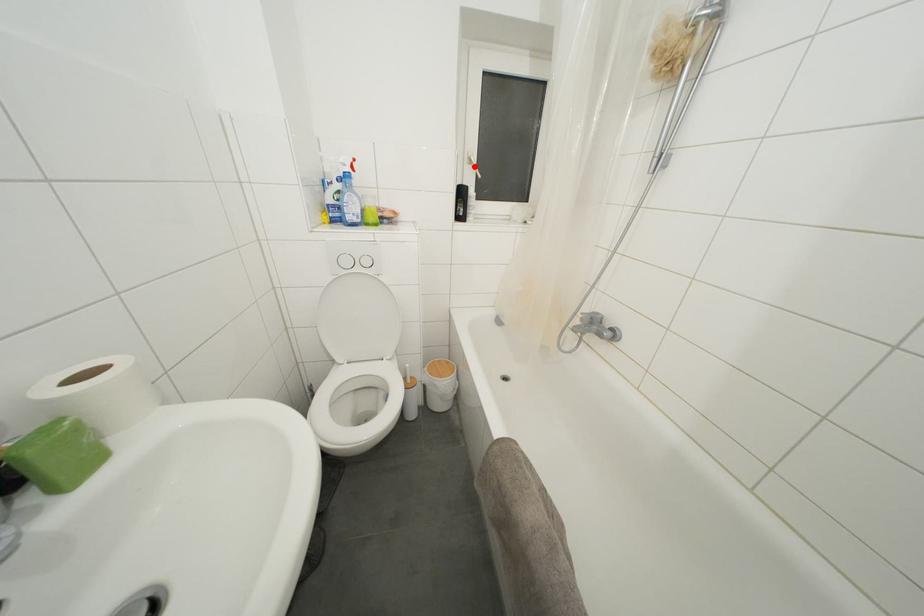
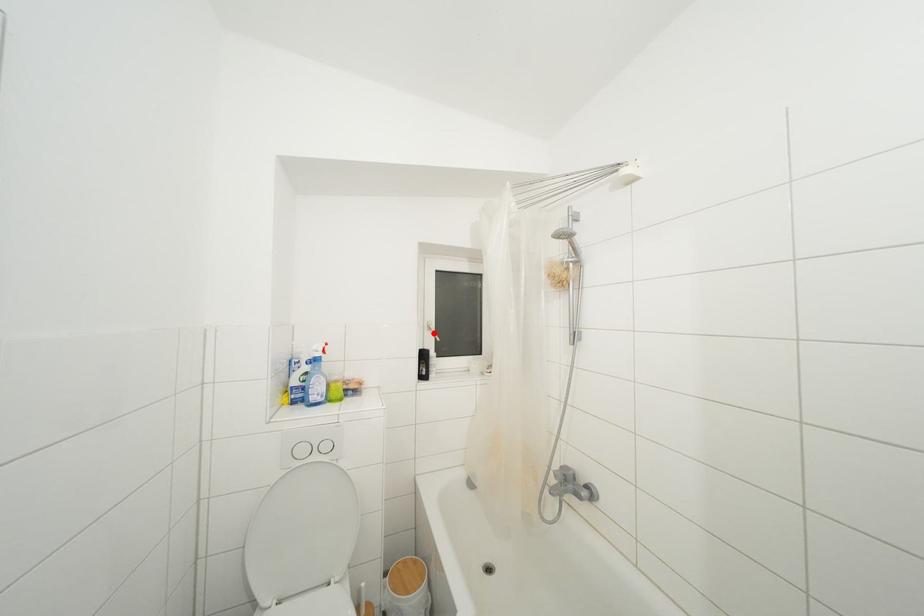
I am providing you with two images of the same scene from different viewpoints. A red point is marked on the first image and another point is marked on the second image. Is the marked point in image1 the same physical position as the marked point in image2?

Yes